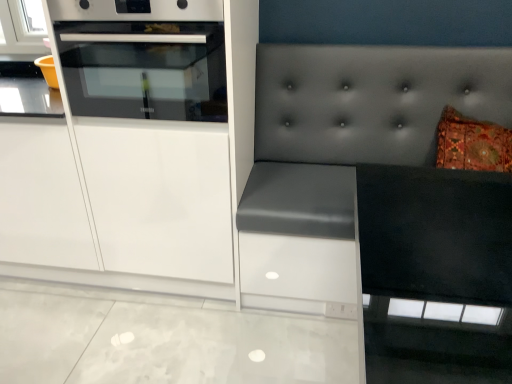
Question: Is point (190, 221) closer or farther from the camera than point (305, 64)?

Choices:
 (A) farther
 (B) closer

Answer: (B)

Question: Is white glossy cabinet at left inside the boundaries of matte gray cushion at right, or outside?

Choices:
 (A) inside
 (B) outside

Answer: (B)

Question: Considering the real-world distances, which object is farthest from the white glossy oven at upper left?

Choices:
 (A) white glossy cabinet at left
 (B) matte gray cushion at right

Answer: (B)

Question: Based on their relative distances, which object is farther from the matte gray cushion at right?

Choices:
 (A) white glossy cabinet at left
 (B) white glossy oven at upper left

Answer: (B)